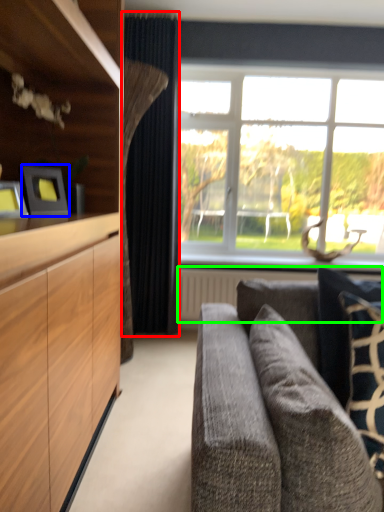
Question: Which object is the closest to the curtain (highlighted by a red box)? Choose among these: picture frame (highlighted by a blue box) or radiator (highlighted by a green box).

Choices:
 (A) picture frame
 (B) radiator

Answer: (B)